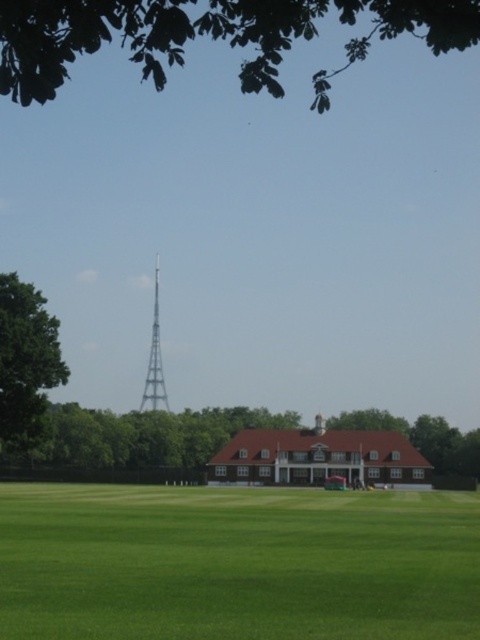
You are standing at the center of the grassy field and want to walk to the green leafy tree at left. Which direction should you head towards?

The green leafy tree at left is located at point (26, 364), which means you should head towards the left direction from your current position at the center of the grassy field to reach it.

You are standing in the middle of the green leafy tree at lower center. Looking towards the building with a red roof, which direction should you turn to face the green leafy tree at upper center?

You should turn to your right to face the green leafy tree at upper center since it is located to the right of the green leafy tree at lower center.

You are standing at the entrance of the building with a red roof and white walls. Looking towards the telecommunications tower on the left, where is the green leafy tree at upper center in relation to your view?

The green leafy tree at upper center is located at point 0.056 on the x axis and 0.433 on the y axis relative to your position at the building entrance facing the telecommunications tower on the left.